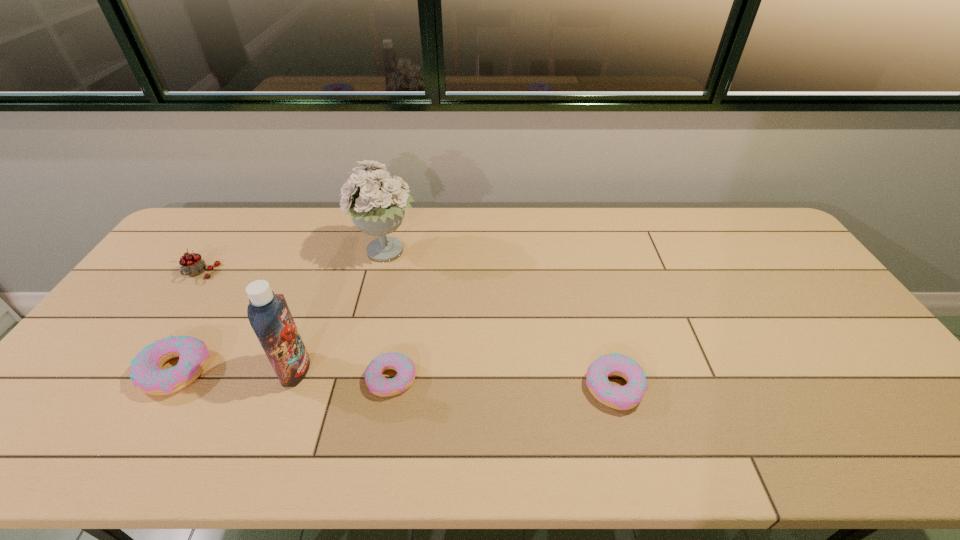
Where is `unoccupied area between the rightmost doughnut and the bouquet`? The width and height of the screenshot is (960, 540). unoccupied area between the rightmost doughnut and the bouquet is located at coordinates (500, 320).

Locate an element on the screen. vacant space that is in between the shortest doughnut and the rightmost object is located at coordinates (503, 383).

Image resolution: width=960 pixels, height=540 pixels. In order to click on object that is the closest to the third tallest object in this screenshot , I will do `click(146, 374)`.

Select which object is the second closest to the leftmost doughnut. Please provide its 2D coordinates. Your answer should be formatted as a tuple, i.e. [(x, y)], where the tuple contains the x and y coordinates of a point satisfying the conditions above.

[(192, 264)]

Locate which doughnut ranks third in proximity to the bouquet. Please provide its 2D coordinates. Your answer should be formatted as a tuple, i.e. [(x, y)], where the tuple contains the x and y coordinates of a point satisfying the conditions above.

[(626, 397)]

Locate an element on the screen. The image size is (960, 540). doughnut object that ranks as the closest to the leftmost doughnut is located at coordinates (379, 385).

This screenshot has width=960, height=540. Identify the location of free space that satisfies the following two spatial constraints: 1. on the handle side of the cherry; 2. on the left side of the second doughnut from left to right. (128, 379).

This screenshot has height=540, width=960. I want to click on free spot that satisfies the following two spatial constraints: 1. on the front side of the shortest object; 2. on the left side of the second shortest object, so click(390, 387).

Where is `vacant position in the image that satisfies the following two spatial constraints: 1. on the handle side of the leftmost doughnut; 2. on the left side of the third tallest object`? Image resolution: width=960 pixels, height=540 pixels. vacant position in the image that satisfies the following two spatial constraints: 1. on the handle side of the leftmost doughnut; 2. on the left side of the third tallest object is located at coordinates (133, 371).

Image resolution: width=960 pixels, height=540 pixels. Identify the location of free spot that satisfies the following two spatial constraints: 1. on the handle side of the fourth shortest object; 2. on the right side of the second tallest doughnut. (123, 387).